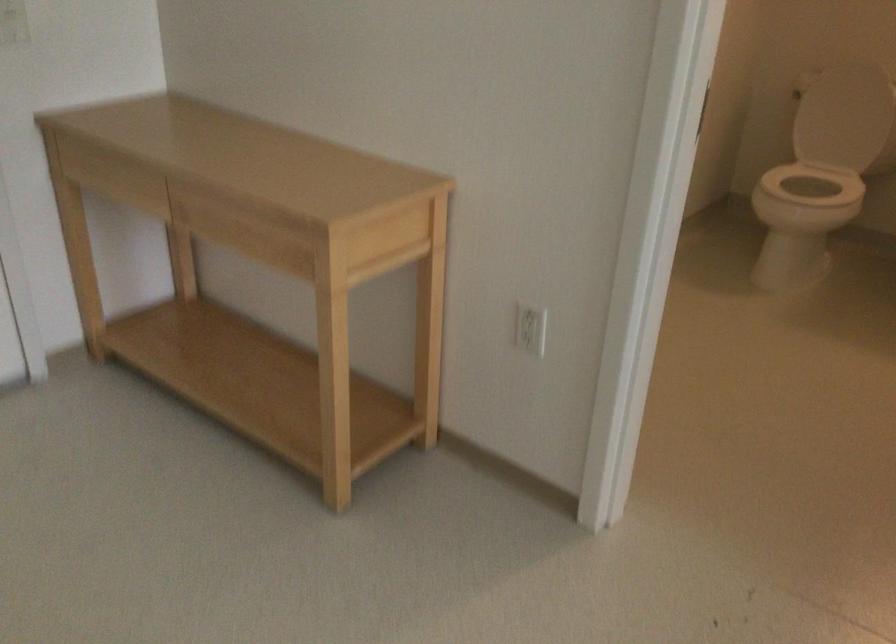
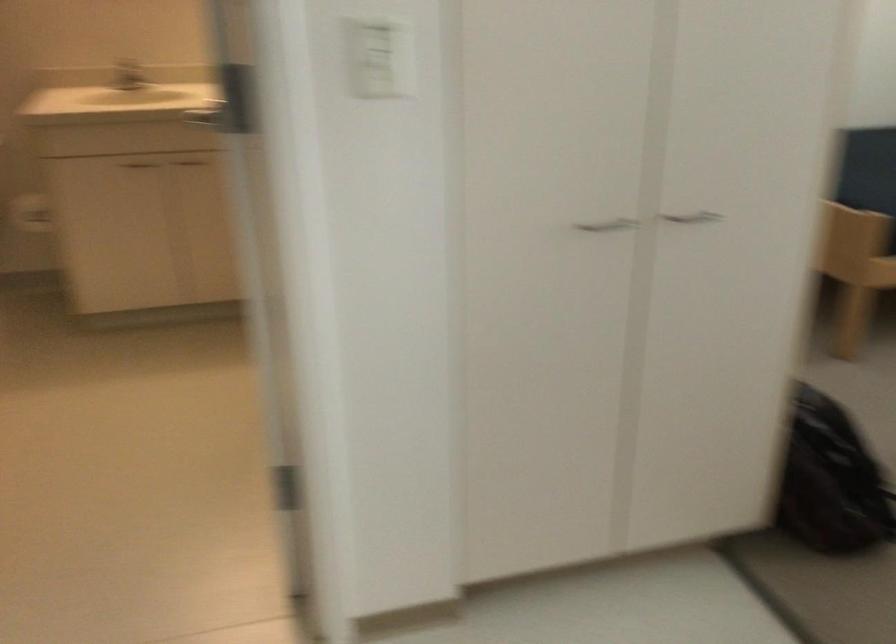
Question: Based on the continuous images, in which direction is the camera rotating? Reply with the corresponding letter.

Choices:
 (A) Left
 (B) Right
 (C) Up
 (D) Down

Answer: (B)